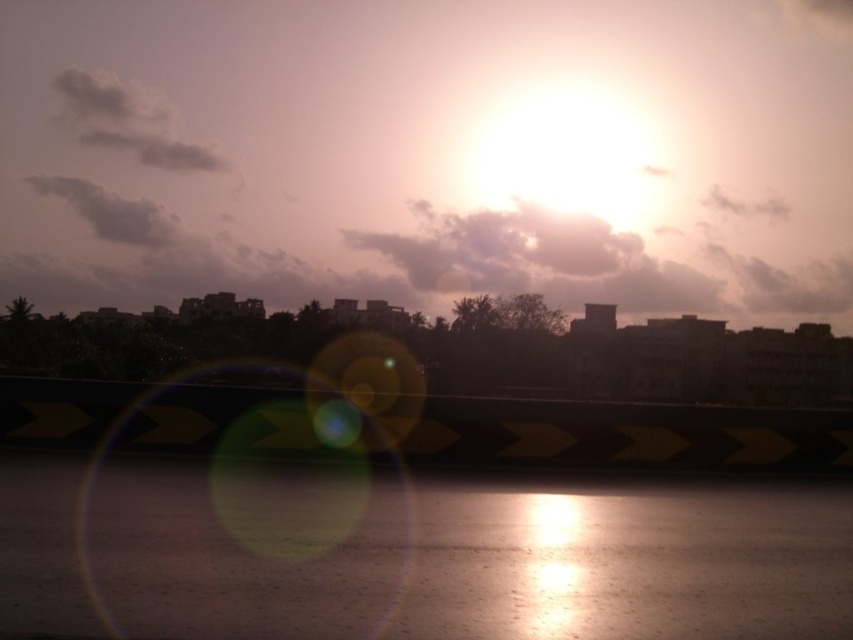
Question: Is yellow-black striped barrier at bottom below gray fluffy cloud at upper left?

Choices:
 (A) yes
 (B) no

Answer: (A)

Question: Which point appears farthest from the camera in this image?

Choices:
 (A) (109, 204)
 (B) (152, 163)
 (C) (723, 452)

Answer: (B)

Question: Does white fluffy cloud at upper left have a larger size compared to gray fluffy cloud at upper left?

Choices:
 (A) no
 (B) yes

Answer: (B)

Question: Can you confirm if yellow-black striped barrier at bottom is positioned above gray fluffy cloud at upper left?

Choices:
 (A) yes
 (B) no

Answer: (B)

Question: Which point is closer to the camera?

Choices:
 (A) (672, 419)
 (B) (99, 122)
 (C) (103, 212)

Answer: (A)

Question: Which of the following is the closest to the observer?

Choices:
 (A) gray fluffy cloud at upper left
 (B) yellow-black striped barrier at bottom

Answer: (B)